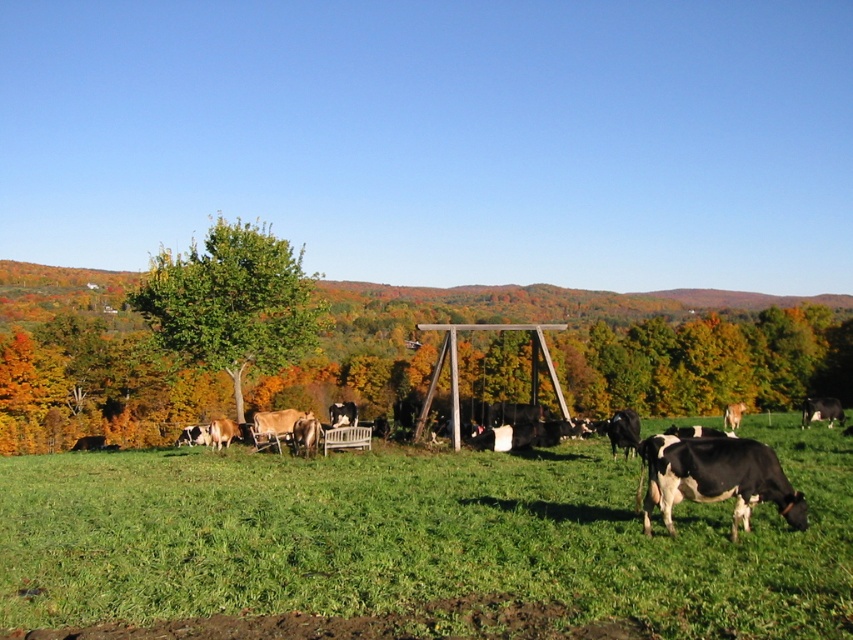
You are standing in the middle of the green grassy field at center and want to look up to see the green leafy tree at center. Which direction should you look?

You should look upwards because the green leafy tree at center is above the green grassy field at center.

You are standing at the center of the pasture and see the black glossy cow at lower right and the black and white cow at right. Which cow is closer to you?

The black glossy cow at lower right is closer to you since it is only 55.26 feet away from the black and white cow at right, but the distance from you to each cow depends on their positions relative to the center. Wait, the description only states the distance between the two cows, not their distance from the observer. Hmm, I need to reevaluate. The question asks which is closer to the observer, but the given data only provides the distance between the two cows. Without knowing their positions relative to a

You are a photographer standing at the camera position. You want to take a photo that includes both point (450, 579) and point (241, 250). Which point will appear larger in the photo?

Point (450, 579) is closer to the camera than point (241, 250), so it will appear larger in the photo.